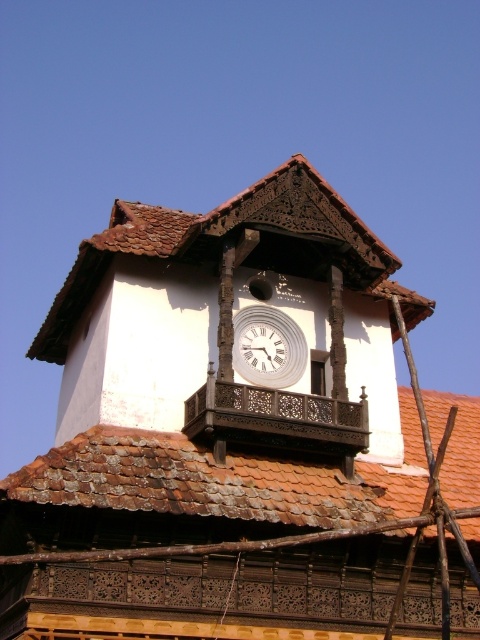
Can you confirm if brown tiled roof at upper center is thinner than white wooden clock at center?

In fact, brown tiled roof at upper center might be wider than white wooden clock at center.

Is brown tiled roof at upper center positioned in front of white wooden clock at center?

That is True.

Which is in front, point (203, 232) or point (263, 353)?

Point (203, 232) is more forward.

What are the coordinates of `brown tiled roof at upper center` in the screenshot? It's located at (235, 241).

Which of these two, brown tiled roof at upper center or white glossy clock at center, stands shorter?

white glossy clock at center

Between point (100, 257) and point (240, 320), which one is positioned behind?

Point (240, 320)

Between point (78, 317) and point (282, 376), which one is positioned behind?

Point (78, 317)

I want to click on brown tiled roof at upper center, so click(235, 241).

Between rusty tiled roof at center and brown tiled roof at upper center, which one is positioned lower?

rusty tiled roof at center

Between rusty tiled roof at center and brown tiled roof at upper center, which one appears on the right side from the viewer's perspective?

rusty tiled roof at center

Locate an element on the screen. This screenshot has height=640, width=480. rusty tiled roof at center is located at coordinates (219, 480).